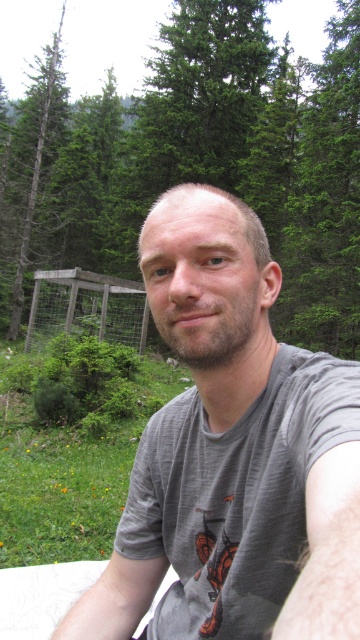
Is green leafy tree at upper center positioned before gray matte t-shirt at center?

That is False.

Which is above, green leafy tree at upper center or gray matte t-shirt at center?

green leafy tree at upper center

Identify the location of green leafy tree at upper center. (221, 157).

The width and height of the screenshot is (360, 640). What are the coordinates of `green leafy tree at upper center` in the screenshot? It's located at (221, 157).

Is green leafy tree at upper center behind green leafy tree at left?

No, it is in front of green leafy tree at left.

Is point (113, 266) positioned before point (30, 221)?

That is True.

At what (x,y) coordinates should I click in order to perform the action: click on green leafy tree at upper center. Please return your answer as a coordinate pair (x, y). The height and width of the screenshot is (640, 360). Looking at the image, I should click on (221, 157).

Who is positioned more to the left, gray matte t-shirt at center or green leafy tree at left?

green leafy tree at left

How distant is gray matte t-shirt at center from green leafy tree at left?

A distance of 29.94 meters exists between gray matte t-shirt at center and green leafy tree at left.

Find the location of a particular element. gray matte t-shirt at center is located at coordinates (213, 300).

The height and width of the screenshot is (640, 360). Find the location of `gray matte t-shirt at center`. gray matte t-shirt at center is located at coordinates (213, 300).